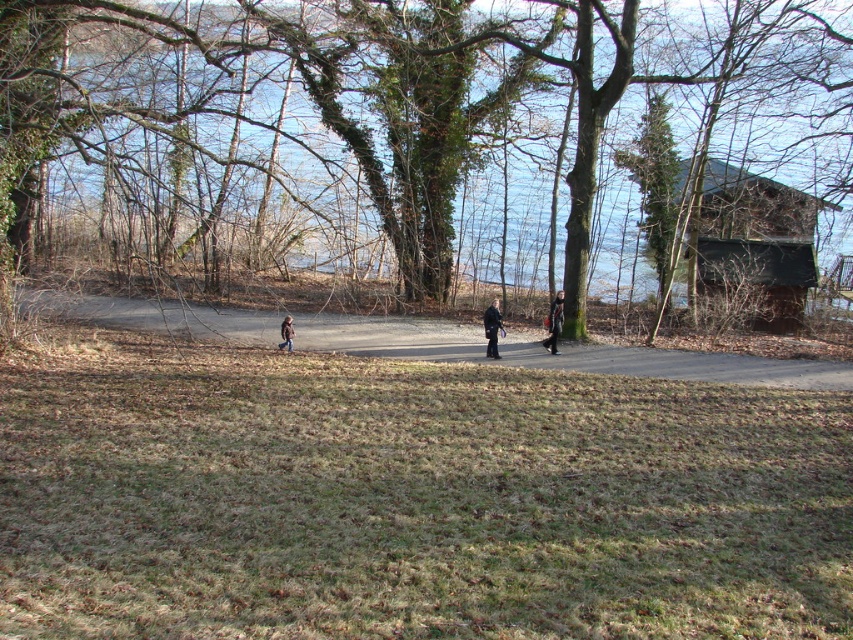
Question: Which object is closer to the camera taking this photo?

Choices:
 (A) black matte coat at center
 (B) brown textured tree at center
 (C) dirt road at center

Answer: (B)

Question: From the image, what is the correct spatial relationship of dirt road at center in relation to black matte coat at center?

Choices:
 (A) left
 (B) right

Answer: (A)

Question: Which point is farther to the camera?

Choices:
 (A) tap(500, 45)
 (B) tap(532, 337)
 (C) tap(485, 326)

Answer: (A)

Question: Does black matte coat at center have a greater width compared to dark gray jacket at center?

Choices:
 (A) yes
 (B) no

Answer: (B)

Question: From the image, what is the correct spatial relationship of brown textured tree at center in relation to black matte coat at center?

Choices:
 (A) below
 (B) above

Answer: (B)

Question: Which is nearer to the brown textured tree at center?

Choices:
 (A) brown fuzzy jacket at center
 (B) black matte coat at center

Answer: (A)